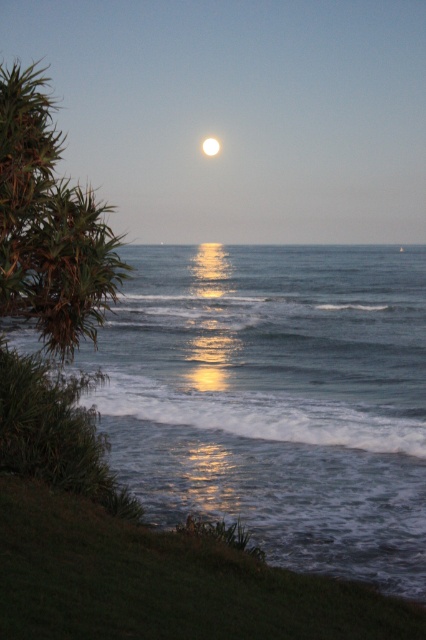
Looking at this image, between smooth reflective water at center and bright white sphere at center, which one is positioned lower?

smooth reflective water at center

Is point (172, 102) less distant than point (206, 145)?

No.

Where is `smooth reflective water at center`? smooth reflective water at center is located at coordinates (238, 115).

Does glistening blue water at lower center have a lesser height compared to smooth reflective water at center?

Indeed, glistening blue water at lower center has a lesser height compared to smooth reflective water at center.

Does glistening blue water at lower center appear on the left side of smooth reflective water at center?

Incorrect, glistening blue water at lower center is not on the left side of smooth reflective water at center.

Who is more forward, [325,410] or [311,150]?

Point [325,410] is more forward.

I want to click on glistening blue water at lower center, so click(276, 397).

Which is more to the left, glistening blue water at lower center or bright white sphere at center?

Positioned to the left is bright white sphere at center.

Which is behind, point (91, 401) or point (209, 145)?

Point (209, 145)

Locate an element on the screen. The width and height of the screenshot is (426, 640). glistening blue water at lower center is located at coordinates (276, 397).